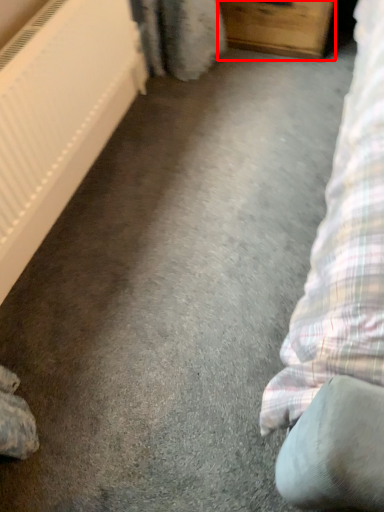
Question: From the image, what is the correct spatial relationship of furniture (annotated by the red box) in relation to radiator?

Choices:
 (A) right
 (B) left

Answer: (A)